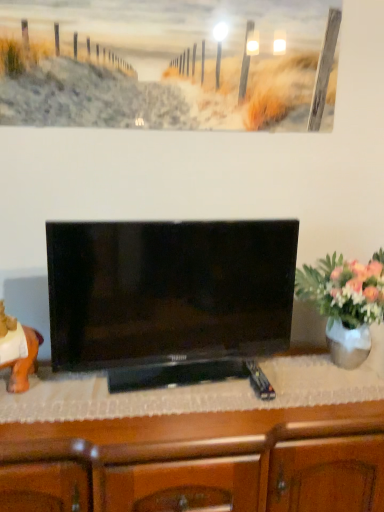
Question: From a real-world perspective, is wooden cabinet at center physically located above or below orange matte statue at left?

Choices:
 (A) below
 (B) above

Answer: (A)

Question: Choose the correct answer: Is wooden cabinet at center inside orange matte statue at left or outside it?

Choices:
 (A) inside
 (B) outside

Answer: (B)

Question: Which is nearer to the black glossy tv at center?

Choices:
 (A) white glossy vase at right
 (B) wooden cabinet at center
 (C) orange matte statue at left

Answer: (B)

Question: Which object is positioned farthest from the wooden cabinet at center?

Choices:
 (A) orange matte statue at left
 (B) white glossy vase at right
 (C) black glossy tv at center

Answer: (A)